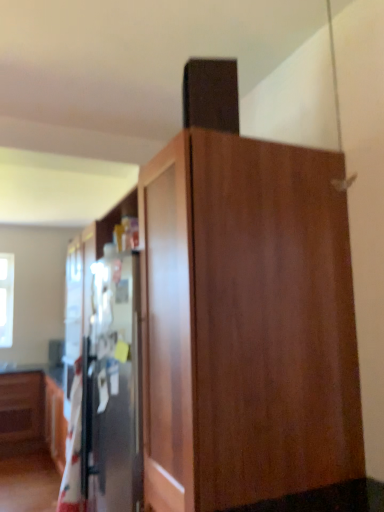
Question: Considering the positions of transparent glass window at upper left and wooden cabinet at center in the image, is transparent glass window at upper left bigger or smaller than wooden cabinet at center?

Choices:
 (A) small
 (B) big

Answer: (A)

Question: Considering the positions of transparent glass window at upper left and wooden cabinet at center in the image, is transparent glass window at upper left taller or shorter than wooden cabinet at center?

Choices:
 (A) short
 (B) tall

Answer: (A)

Question: Which object is the farthest from the white cotton blanket at left?

Choices:
 (A) transparent glass window at upper left
 (B) wooden cabinet at center

Answer: (A)

Question: Which is farther from the white cotton blanket at left?

Choices:
 (A) transparent glass window at upper left
 (B) wooden cabinet at center

Answer: (A)